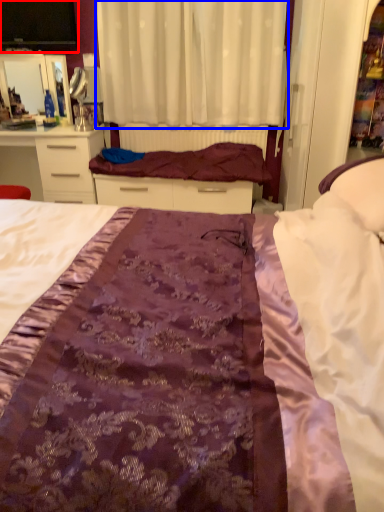
Question: Which object appears farthest to the camera in this image, desktop (highlighted by a red box) or curtain (highlighted by a blue box)?

Choices:
 (A) desktop
 (B) curtain

Answer: (A)